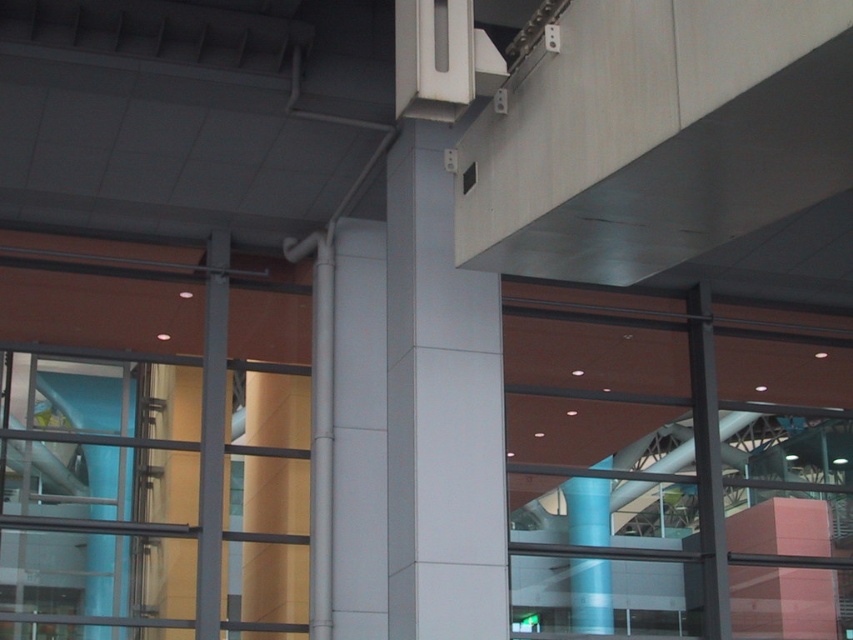
You are an architect analyzing the layout of a modern building. You notice two columns in the design, the white glossy pillar at center and the blue glossy column at center. From the perspective of someone standing in front of the glass facade, which column would appear closer to the left side?

The white glossy pillar at center is to the left of the blue glossy column at center, so from the perspective of someone standing in front of the glass facade, the white glossy pillar at center would appear closer to the left side.

You are an architect designing a new exhibition space. You need to place a sculpture that requires a minimum of 12 meters of space between two supporting structures. Given the white glossy pillar at center and the blue glossy column at center in the image, can these two structures be used as the supporting points for the sculpture?

The distance between the white glossy pillar at center and the blue glossy column at center is 13.15 meters, which exceeds the required 12 meters. Therefore, these two structures can be used as the supporting points for the sculpture.

You are standing in the modern architectural space and want to take a photo of the white glossy pillar at center. If your camera can focus on objects up to 10 meters away, will you need to move closer to get a clear shot?

The white glossy pillar at center is 12.29 meters from the viewer. Since the camera can only focus up to 10 meters, you need to move closer to ensure the pillar is within the focus range.